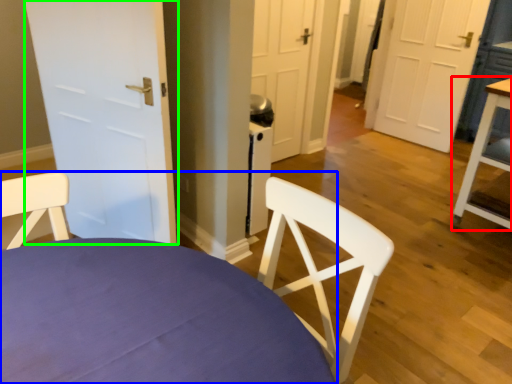
Question: Which is nearer to the table (highlighted by a red box)? chair (highlighted by a blue box) or door (highlighted by a green box).

Choices:
 (A) chair
 (B) door

Answer: (B)